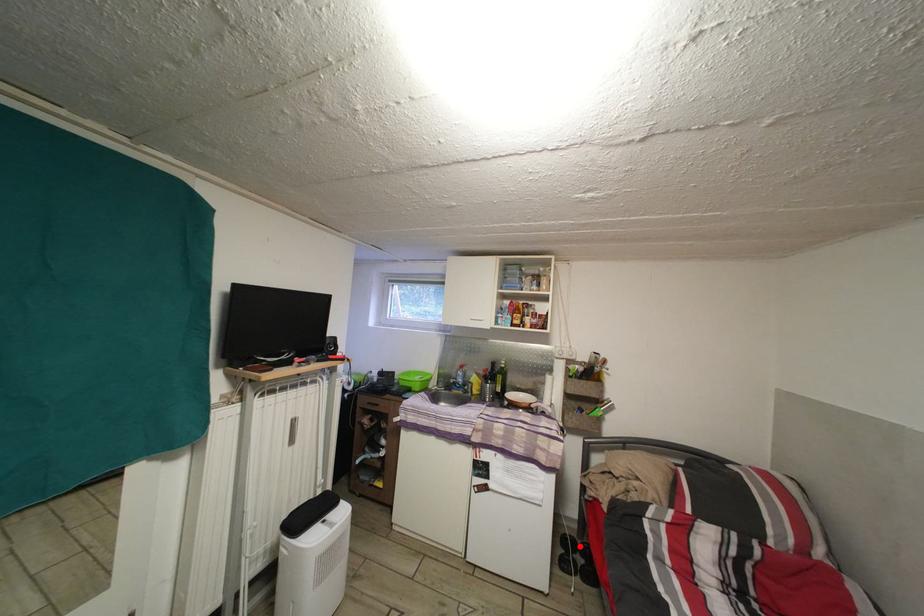
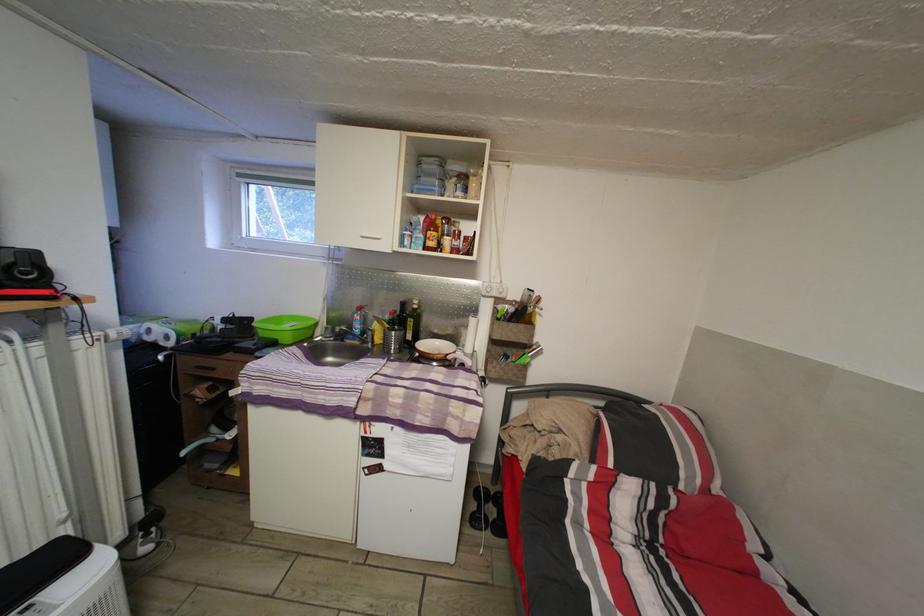
Question: I am providing you with two images of the same scene from different viewpoints. Image1 has a red point marked. In image2, the corresponding 3D location appears at what relative position? Reply with the corresponding letter.

Choices:
 (A) Closer
 (B) Farther

Answer: (B)